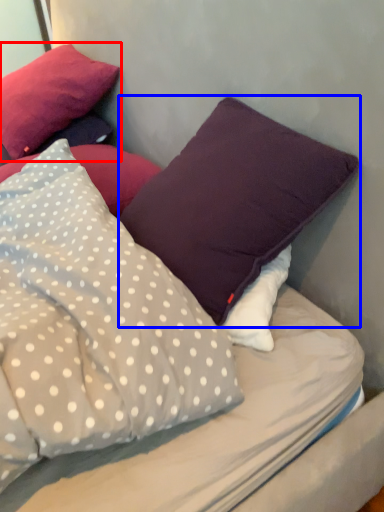
Question: Which point is further to the camera, pillow (highlighted by a red box) or pillow (highlighted by a blue box)?

Choices:
 (A) pillow
 (B) pillow

Answer: (A)